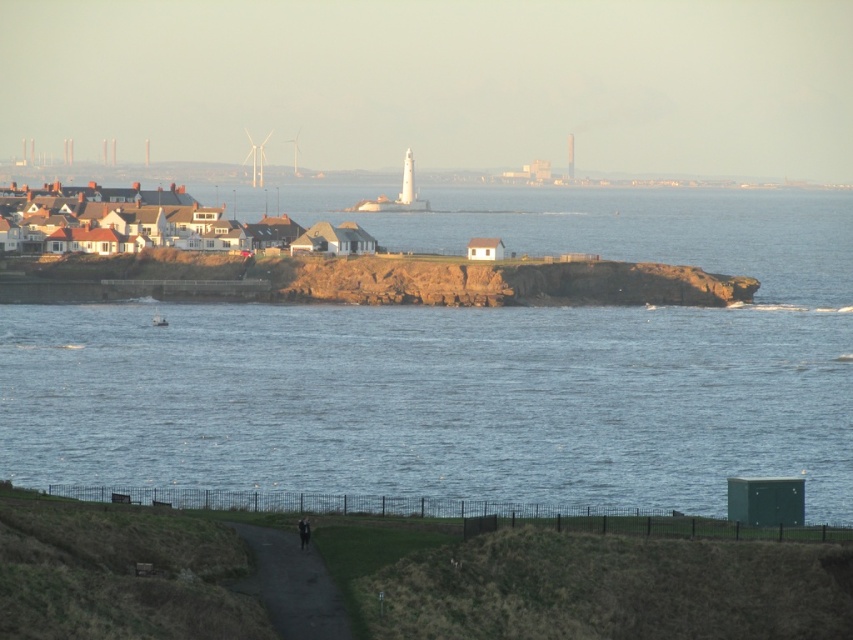
Is blue water at center positioned in front of dirt/gravel path at lower center?

That is False.

Which is behind, point (564, 310) or point (339, 593)?

The point (564, 310) is more distant.

Find the location of a particular element. The height and width of the screenshot is (640, 853). blue water at center is located at coordinates (432, 401).

From the picture: Who is shorter, blue water at center or black leather jacket at lower center?

black leather jacket at lower center is shorter.

Between point (660, 422) and point (306, 524), which one is positioned in front?

Point (306, 524)

Does point (788, 385) come farther from viewer compared to point (299, 524)?

Yes, it is behind point (299, 524).

At what (x,y) coordinates should I click in order to perform the action: click on blue water at center. Please return your answer as a coordinate pair (x, y). Image resolution: width=853 pixels, height=640 pixels. Looking at the image, I should click on (432, 401).

Looking at this image, does white matte houses at left have a smaller size compared to black leather jacket at lower center?

Incorrect, white matte houses at left is not smaller in size than black leather jacket at lower center.

Does white matte houses at left come behind black leather jacket at lower center?

Yes, it is behind black leather jacket at lower center.

Measure the distance between point (222,209) and camera.

Point (222,209) is 225.66 meters away from camera.

Identify the location of white matte houses at left. The height and width of the screenshot is (640, 853). (155, 225).